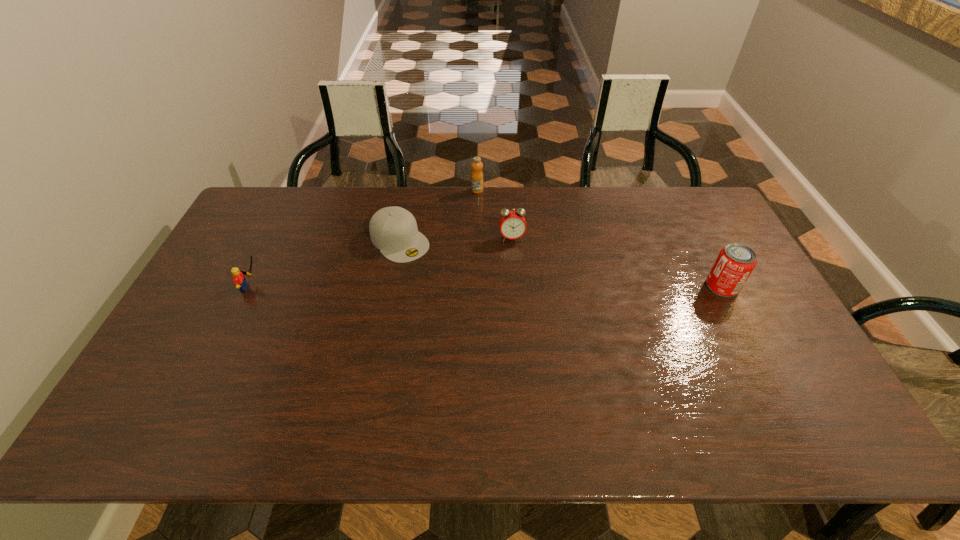
You are a GUI agent. You are given a task and a screenshot of the screen. Output one action in this format:
    pyautogui.click(x=<x>, y=<y>)
    Task: Click on the vacant space on the desktop that is between the Lego and the rightmost object and is positioned on the front-facing side of the cap
    
    Given the screenshot: What is the action you would take?
    pyautogui.click(x=446, y=287)

Where is `free space on the desktop that is between the leftmost object and the rightmost object and is positioned on the front-facing side of the second object from right to left`? The height and width of the screenshot is (540, 960). free space on the desktop that is between the leftmost object and the rightmost object and is positioned on the front-facing side of the second object from right to left is located at coordinates (520, 287).

You are a GUI agent. You are given a task and a screenshot of the screen. Output one action in this format:
    pyautogui.click(x=<x>, y=<y>)
    Task: Click on the free space on the desktop that is between the Lego and the rightmost object and is positioned on the front label of the farthest object
    This screenshot has width=960, height=540.
    Given the screenshot: What is the action you would take?
    pyautogui.click(x=526, y=287)